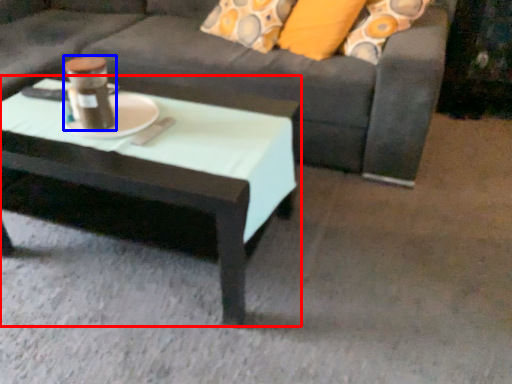
Question: Which point is further to the camera, coffee table (highlighted by a red box) or beverage (highlighted by a blue box)?

Choices:
 (A) coffee table
 (B) beverage

Answer: (B)